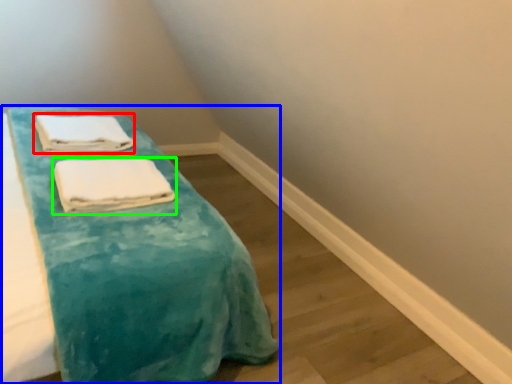
Question: Which object is positioned closest to towel (highlighted by a red box)? Select from furniture (highlighted by a blue box) and towel (highlighted by a green box).

Choices:
 (A) furniture
 (B) towel

Answer: (B)